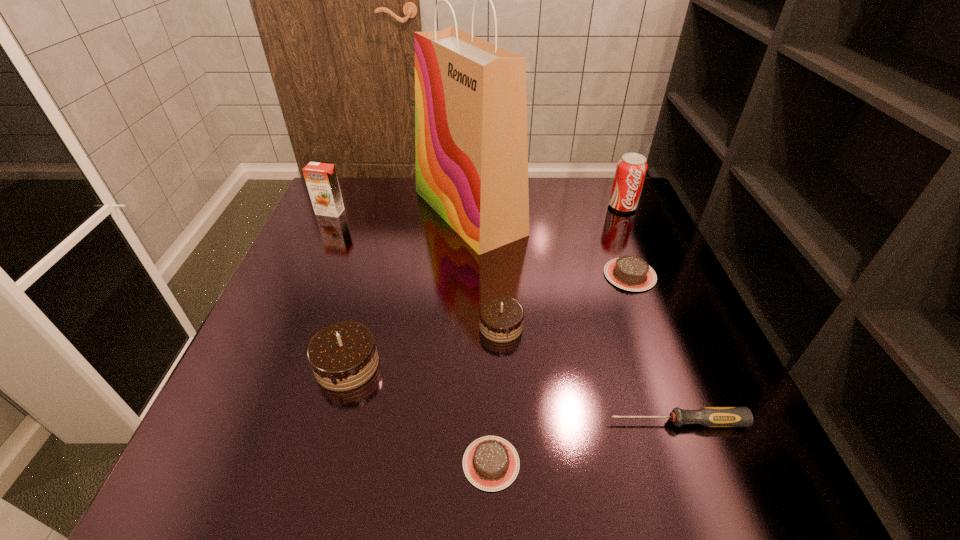
Where is `vacant area that lies between the tallest object and the nearest chocolate cake`? vacant area that lies between the tallest object and the nearest chocolate cake is located at coordinates (480, 338).

The image size is (960, 540). In order to click on free space between the shopping bag and the third shortest chocolate cake in this screenshot , I will do `click(485, 269)`.

Image resolution: width=960 pixels, height=540 pixels. In order to click on free spot between the screwdriver and the tallest object in this screenshot , I will do `click(573, 317)`.

Where is `free area in between the shopping bag and the soda can`? Image resolution: width=960 pixels, height=540 pixels. free area in between the shopping bag and the soda can is located at coordinates (545, 209).

Locate an element on the screen. free space between the farther brown chocolate cake and the soda can is located at coordinates pos(626,241).

You are a GUI agent. You are given a task and a screenshot of the screen. Output one action in this format:
    pyautogui.click(x=<x>, y=<y>)
    Task: Click on the unoccupied area between the shopping bag and the soda can
    The image size is (960, 540).
    Given the screenshot: What is the action you would take?
    pyautogui.click(x=545, y=209)

Locate an element on the screen. This screenshot has height=540, width=960. empty space between the nearest object and the bigger brown chocolate cake is located at coordinates (561, 369).

You are a GUI agent. You are given a task and a screenshot of the screen. Output one action in this format:
    pyautogui.click(x=<x>, y=<y>)
    Task: Click on the empty location between the orange orange juice and the seventh object from right to left
    Image resolution: width=960 pixels, height=540 pixels.
    Given the screenshot: What is the action you would take?
    pyautogui.click(x=339, y=288)

The width and height of the screenshot is (960, 540). I want to click on free space between the bigger chocolate chocolate cake and the shortest object, so (420, 414).

Identify the location of empty space that is in between the second tallest chocolate cake and the screwdriver. (588, 374).